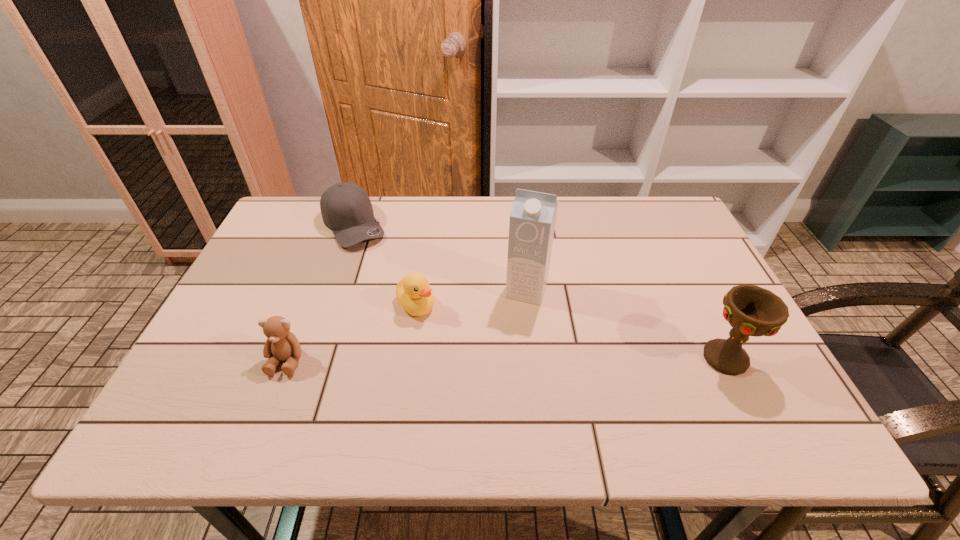
What are the coordinates of `teddy bear` in the screenshot? It's located at (281, 344).

You are a GUI agent. You are given a task and a screenshot of the screen. Output one action in this format:
    pyautogui.click(x=<x>, y=<y>)
    Task: Click on the fourth shortest object
    
    Given the screenshot: What is the action you would take?
    pyautogui.click(x=751, y=310)

The height and width of the screenshot is (540, 960). I want to click on chalice, so click(751, 310).

The width and height of the screenshot is (960, 540). Identify the location of the tallest object. (532, 221).

Where is `carton`? carton is located at coordinates (532, 221).

I want to click on the farthest object, so click(346, 209).

At what (x,y) coordinates should I click in order to perform the action: click on duckling. Please return your answer as a coordinate pair (x, y). The width and height of the screenshot is (960, 540). Looking at the image, I should click on coord(414,295).

Where is `blank space located 0.110m on the back of the chalice`? The image size is (960, 540). blank space located 0.110m on the back of the chalice is located at coordinates (698, 304).

Identify the location of free spot located on the front label of the second object from right to left. The width and height of the screenshot is (960, 540). (496, 382).

Identify the location of free space located 0.150m on the front label of the second object from right to left. (507, 350).